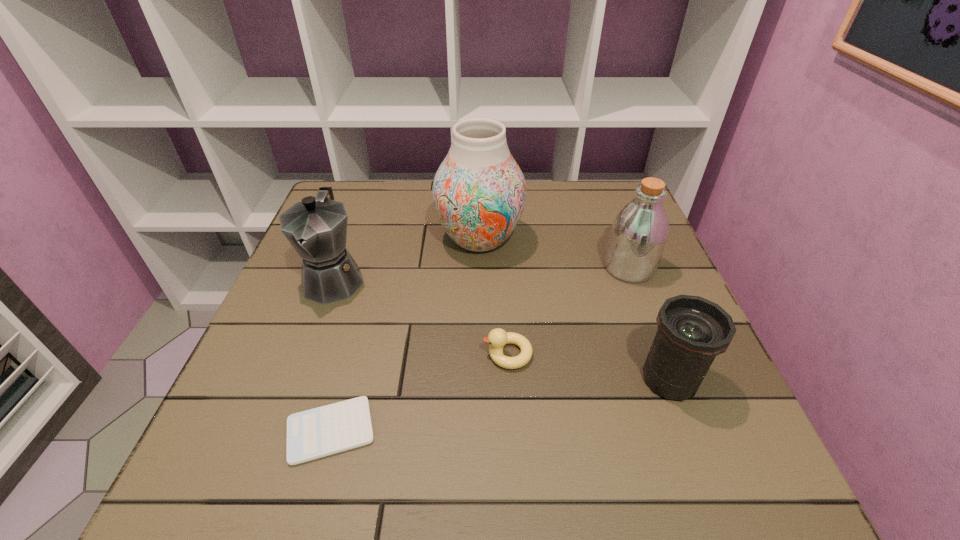
The height and width of the screenshot is (540, 960). I want to click on the tallest object, so click(479, 192).

The width and height of the screenshot is (960, 540). What are the coordinates of `bottle` in the screenshot? It's located at (639, 233).

Where is `coffeepot`? This screenshot has width=960, height=540. coffeepot is located at coordinates (316, 228).

Identify the location of the fourth tallest object. pos(692,331).

At what (x,y) coordinates should I click in order to perform the action: click on duckling. Please return your answer as a coordinate pair (x, y). The width and height of the screenshot is (960, 540). Looking at the image, I should click on (497, 338).

Identify the location of calculator. This screenshot has height=540, width=960. (319, 432).

This screenshot has width=960, height=540. I want to click on vacant space located on the right of the vase, so click(x=656, y=240).

Identify the location of free space located 0.140m on the front of the bottle. This screenshot has height=540, width=960. (654, 333).

At what (x,y) coordinates should I click in order to perform the action: click on vacant space located 0.240m at the spout of the coffeepot. Please return your answer as a coordinate pair (x, y). Looking at the image, I should click on (286, 411).

At what (x,y) coordinates should I click in order to perform the action: click on free location located 0.380m on the left of the telephoto lens. Please return your answer as a coordinate pair (x, y). The height and width of the screenshot is (540, 960). Looking at the image, I should click on (432, 380).